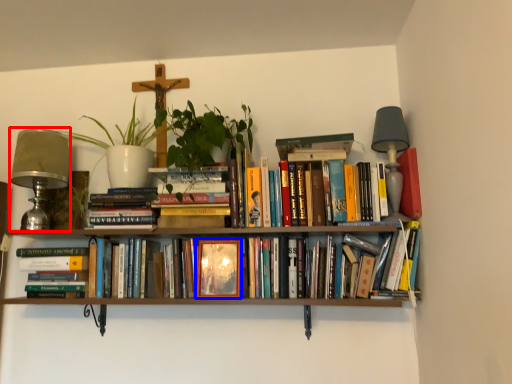
Question: Among these objects, which one is nearest to the camera, table lamp (highlighted by a red box) or paperback book (highlighted by a blue box)?

Choices:
 (A) table lamp
 (B) paperback book

Answer: (B)